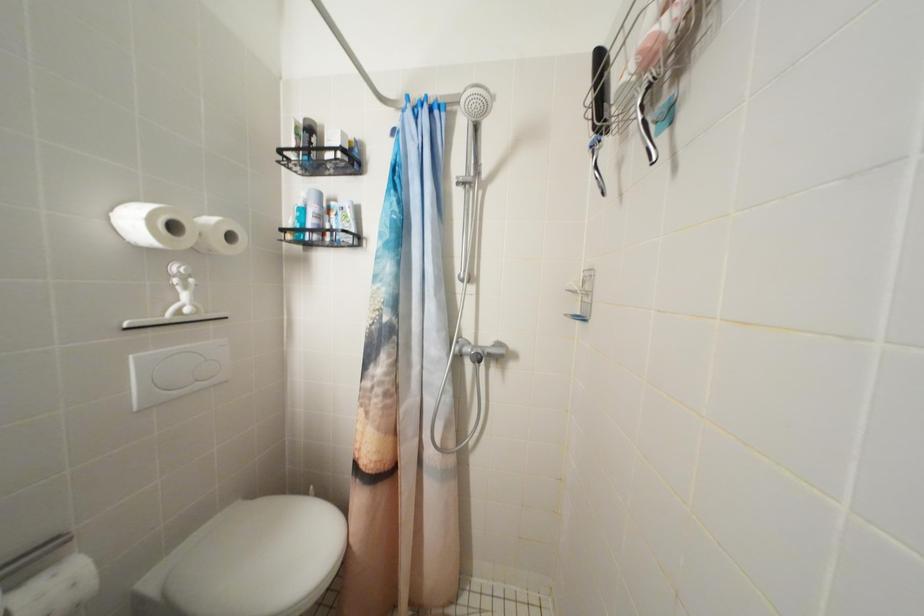
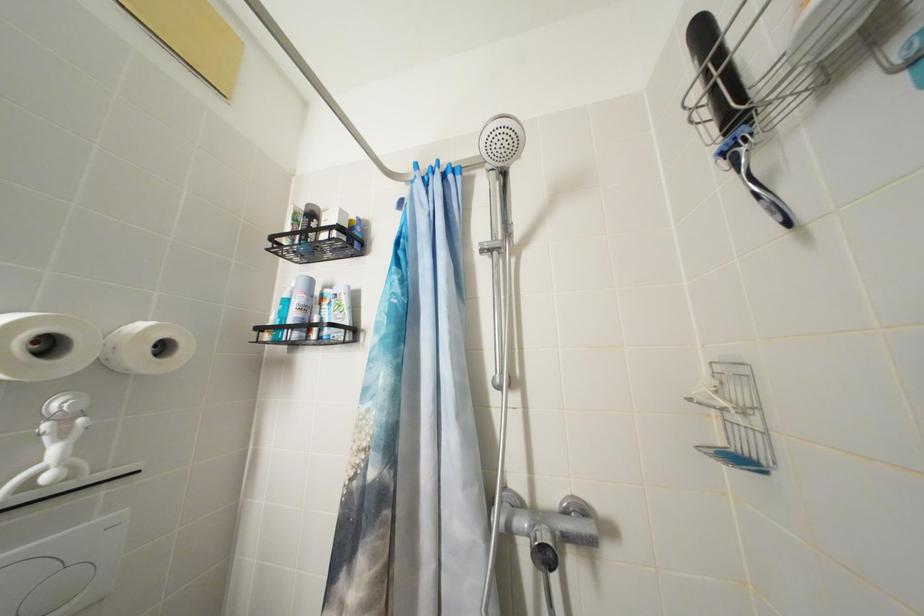
Question: In a continuous first-person perspective shot, in which direction is the camera moving?

Choices:
 (A) Left
 (B) Right
 (C) Forward
 (D) Backward

Answer: (C)